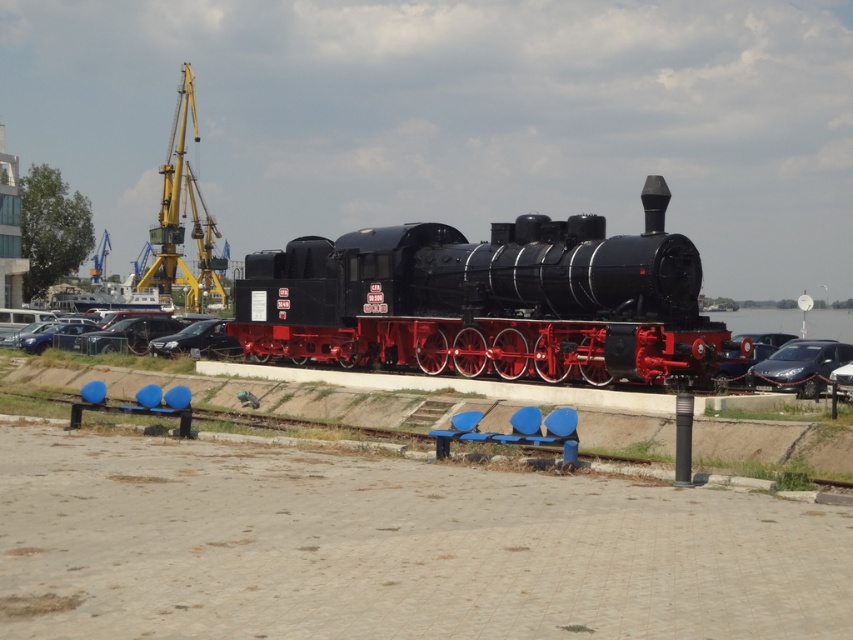
Is shiny black sedan at left thinner than satin black car at center?

No.

Which is behind, point (91, 352) or point (183, 326)?

The point (183, 326) is behind.

Who is more distant from viewer, [107,336] or [183,349]?

Positioned behind is point [107,336].

I want to click on shiny black sedan at left, so click(126, 333).

Does shiny silver sedan at right appear over transparent glass water at center?

No, shiny silver sedan at right is not above transparent glass water at center.

Who is lower down, shiny silver sedan at right or transparent glass water at center?

shiny silver sedan at right

Does point (752, 376) lie behind point (834, 333)?

No, it is not.

Where is `shiny silver sedan at right`? Image resolution: width=853 pixels, height=640 pixels. shiny silver sedan at right is located at coordinates (799, 365).

Is transparent glass water at center above satin black car at center?

Correct, transparent glass water at center is located above satin black car at center.

The width and height of the screenshot is (853, 640). I want to click on transparent glass water at center, so coord(759,321).

Locate an element on the screen. The image size is (853, 640). transparent glass water at center is located at coordinates (759, 321).